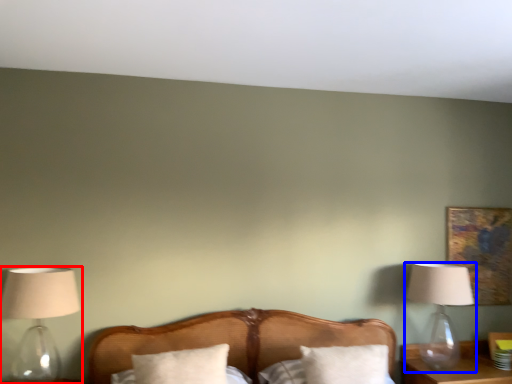
Question: Which object appears closest to the camera in this image, lamp (highlighted by a red box) or lamp (highlighted by a blue box)?

Choices:
 (A) lamp
 (B) lamp

Answer: (A)